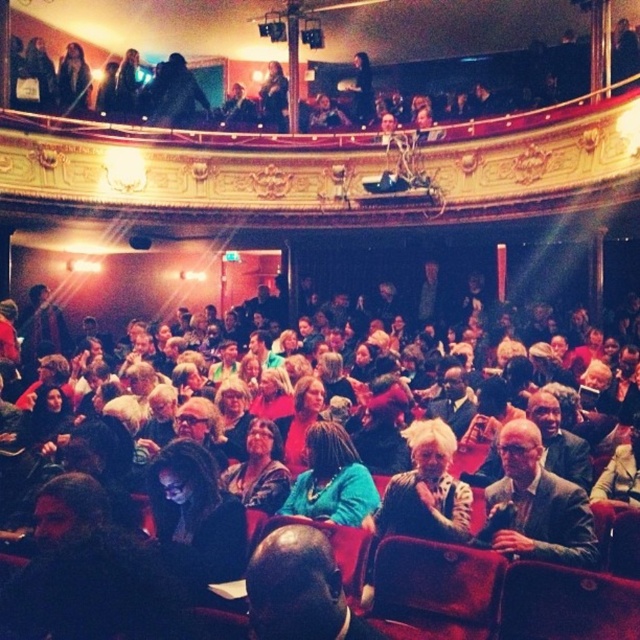
Which is behind, point (324, 484) or point (228, 490)?

Point (228, 490)

Does teal fabric dress at center have a lesser width compared to dark brown leather jacket at center?

No.

Is point (369, 497) closer to viewer compared to point (273, 445)?

Yes, point (369, 497) is in front of point (273, 445).

Identify the location of teal fabric dress at center. This screenshot has height=640, width=640. (332, 480).